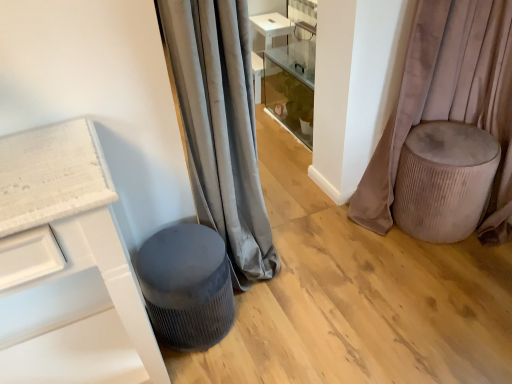
Locate an element on the screen. This screenshot has height=384, width=512. spots to the right of gray velvet curtain at center, which is the 1th curtain from left to right is located at coordinates (332, 260).